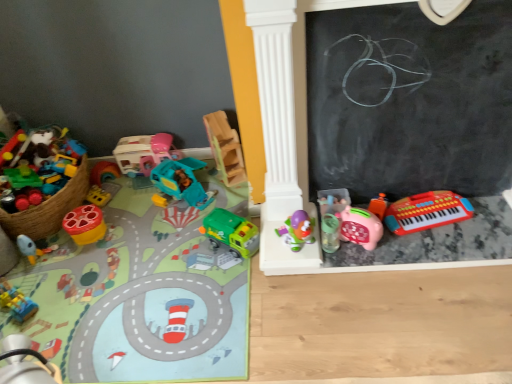
Where is `free space above black chalkboard at right (from a real-world perspective)`? free space above black chalkboard at right (from a real-world perspective) is located at coordinates (412, 5).